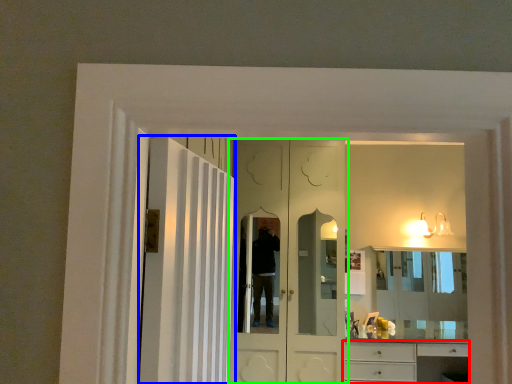
Question: Which object is the closest to the cabinetry (highlighted by a red box)? Choose among these: door (highlighted by a blue box) or door (highlighted by a green box).

Choices:
 (A) door
 (B) door

Answer: (B)